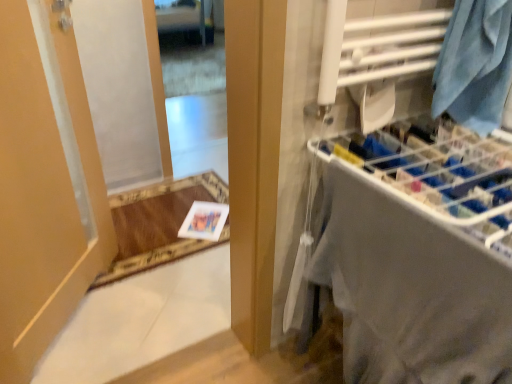
Measure the distance between point [46,90] and camera.

The depth of point [46,90] is 1.43 meters.

Locate an element on the screen. This screenshot has height=384, width=512. matte beige door at left is located at coordinates (45, 186).

Locate an element on the screen. blue fabric at upper right is located at coordinates (475, 64).

The height and width of the screenshot is (384, 512). I want to click on matte beige door at left, so click(45, 186).

Is blue fabric at upper right positioned far away from matte beige door at left?

That's right, there is a large distance between blue fabric at upper right and matte beige door at left.

From a real-world perspective, is blue fabric at upper right positioned above or below matte beige door at left?

blue fabric at upper right is above matte beige door at left.

Is the position of blue fabric at upper right more distant than that of matte beige door at left?

Yes, it is.

Considering the positions of objects blue fabric at upper right and matte beige door at left in the image provided, who is more to the right, blue fabric at upper right or matte beige door at left?

From the viewer's perspective, blue fabric at upper right appears more on the right side.

From the picture: From a real-world perspective, is clear glass mirror at upper center over matte beige door at left?

No.

Considering the points (172, 117) and (79, 139), which point is behind, point (172, 117) or point (79, 139)?

The point (172, 117) is farther from the camera.

Can you confirm if clear glass mirror at upper center is shorter than matte beige door at left?

Yes.

Considering the sizes of objects clear glass mirror at upper center and matte beige door at left in the image provided, who is smaller, clear glass mirror at upper center or matte beige door at left?

With smaller size is matte beige door at left.

How different are the orientations of white paper at lower center and matte beige door at left in degrees?

white paper at lower center and matte beige door at left are facing 50 degrees away from each other.

Is white paper at lower center aimed at matte beige door at left?

No, white paper at lower center does not turn towards matte beige door at left.

From a real-world perspective, is white paper at lower center located higher than matte beige door at left?

No, from a real-world perspective, white paper at lower center is not above matte beige door at left.

Is point (130, 210) farther from camera compared to point (441, 195)?

Yes, point (130, 210) is farther from viewer.

You are a GUI agent. You are given a task and a screenshot of the screen. Output one action in this format:
    pyautogui.click(x=<x>, y=<y>)
    Task: Click on the closet below the white paper at lower center (from the image's perspective)
    The width and height of the screenshot is (512, 384).
    Given the screenshot: What is the action you would take?
    (410, 252)

In the image, is white paper at lower center positioned in front of or behind white fabric at right?

In the image, white paper at lower center appears behind white fabric at right.

How different are the orientations of white paper at lower center and white fabric at right in degrees?

The facing directions of white paper at lower center and white fabric at right are 89.2 degrees apart.

From a real-world perspective, is white fabric at right located beneath blue fabric at upper right?

Correct, in the physical world, white fabric at right is lower than blue fabric at upper right.

Consider the image. Is white fabric at right at the left side of blue fabric at upper right?

Correct, you'll find white fabric at right to the left of blue fabric at upper right.

Is white fabric at right far from blue fabric at upper right?

Actually, white fabric at right and blue fabric at upper right are a little close together.

From the image's perspective, which is below, white fabric at right or blue fabric at upper right?

white fabric at right is shown below in the image.

Does blue fabric at upper right have a greater height compared to white paper at lower center?

Yes.

You are a GUI agent. You are given a task and a screenshot of the screen. Output one action in this format:
    pyautogui.click(x=<x>, y=<y>)
    Task: Click on the mat below the blue fabric at upper right (from the image's perspective)
    
    Given the screenshot: What is the action you would take?
    pyautogui.click(x=159, y=224)

Is blue fabric at upper right spatially inside white paper at lower center, or outside of it?

blue fabric at upper right is not enclosed by white paper at lower center.

From a real-world perspective, between blue fabric at upper right and white paper at lower center, who is vertically lower?

white paper at lower center is physically lower.

Is white fabric at right oriented towards white paper at lower center?

No, white fabric at right is not oriented towards white paper at lower center.

At what (x,y) coordinates should I click in order to perform the action: click on mat that is on the left side of white fabric at right. Please return your answer as a coordinate pair (x, y). Image resolution: width=512 pixels, height=384 pixels. Looking at the image, I should click on (159, 224).

Which object is positioned more to the right, white fabric at right or white paper at lower center?

white fabric at right.

From the picture: Is white fabric at right inside the boundaries of white paper at lower center, or outside?

white fabric at right lies outside white paper at lower center.

In the image, there is a matte beige door at left. At what (x,y) coordinates should I click in order to perform the action: click on clothing above it (from the image's perspective). Please return your answer as a coordinate pair (x, y). This screenshot has height=384, width=512. Looking at the image, I should click on (475, 64).

Where is `door in front of the clear glass mirror at upper center`? The height and width of the screenshot is (384, 512). door in front of the clear glass mirror at upper center is located at coordinates (45, 186).

When comparing their distances from matte beige door at left, does blue fabric at upper right or white fabric at right seem further?

Based on the image, blue fabric at upper right appears to be further to matte beige door at left.

Considering their positions, is white paper at lower center positioned closer to blue fabric at upper right than clear glass mirror at upper center?

white paper at lower center.

From the image, which object appears to be nearer to clear glass mirror at upper center, blue fabric at upper right or matte beige door at left?

Based on the image, matte beige door at left appears to be nearer to clear glass mirror at upper center.

Looking at the image, which one is located further to blue fabric at upper right, white fabric at right or matte beige door at left?

The object further to blue fabric at upper right is matte beige door at left.

Which object lies further to the anchor point white fabric at right, blue fabric at upper right or matte beige door at left?

matte beige door at left is positioned further to the anchor white fabric at right.

Estimate the real-world distances between objects in this image. Which object is closer to matte beige door at left, white fabric at right or white paper at lower center?

Based on the image, white paper at lower center appears to be nearer to matte beige door at left.

When comparing their distances from white paper at lower center, does white fabric at right or clear glass mirror at upper center seem closer?

clear glass mirror at upper center.

Estimate the real-world distances between objects in this image. Which object is closer to clear glass mirror at upper center, blue fabric at upper right or white paper at lower center?

white paper at lower center is closer to clear glass mirror at upper center.

The image size is (512, 384). Find the location of `closet between matte beige door at left and blue fabric at upper right`. closet between matte beige door at left and blue fabric at upper right is located at coordinates (410, 252).

At what (x,y) coordinates should I click in order to perform the action: click on mat situated between matte beige door at left and blue fabric at upper right from left to right. Please return your answer as a coordinate pair (x, y). Image resolution: width=512 pixels, height=384 pixels. Looking at the image, I should click on (159, 224).

Where is `mat between matte beige door at left and clear glass mirror at upper center along the z-axis`? The height and width of the screenshot is (384, 512). mat between matte beige door at left and clear glass mirror at upper center along the z-axis is located at coordinates coord(159,224).

You are a GUI agent. You are given a task and a screenshot of the screen. Output one action in this format:
    pyautogui.click(x=<x>, y=<y>)
    Task: Click on the clothing positioned between matte beige door at left and clear glass mirror at upper center from near to far
    
    Given the screenshot: What is the action you would take?
    pyautogui.click(x=475, y=64)